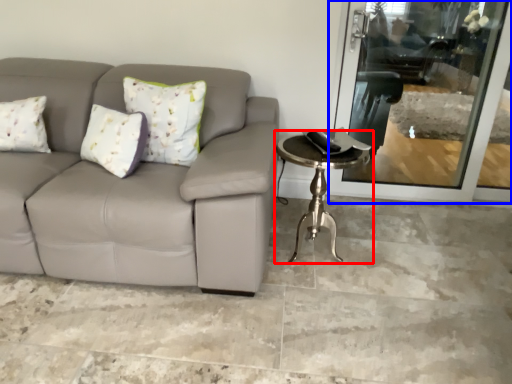
Question: Which object is closer to the camera taking this photo, table (highlighted by a red box) or screen door (highlighted by a blue box)?

Choices:
 (A) table
 (B) screen door

Answer: (A)